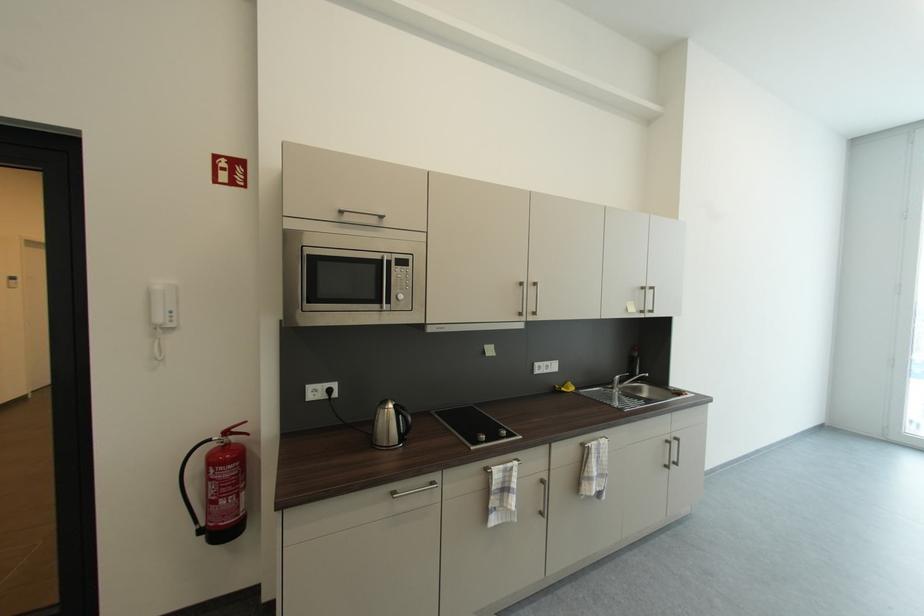
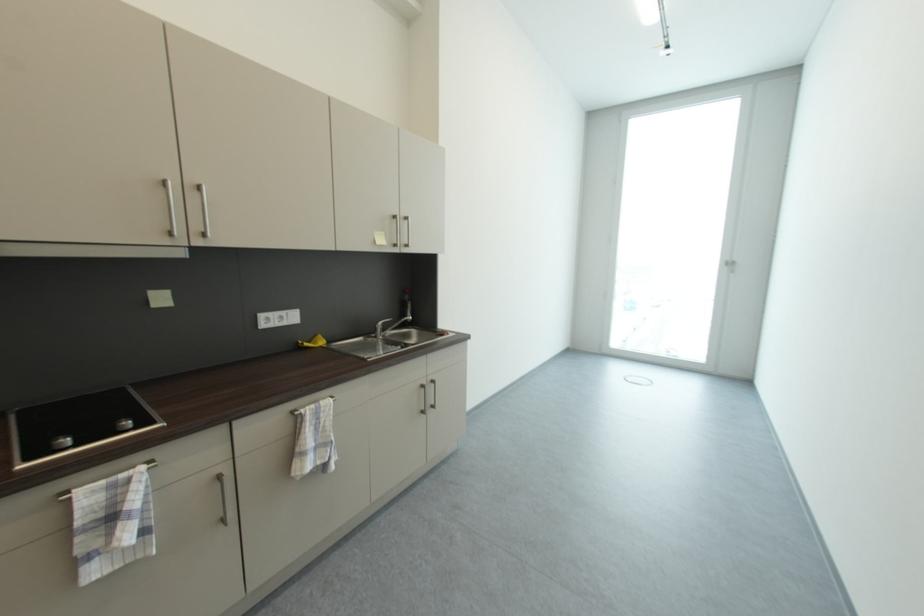
Question: Based on the continuous images, in which direction is the camera rotating? Reply with the corresponding letter.

Choices:
 (A) Left
 (B) Right
 (C) Up
 (D) Down

Answer: (B)